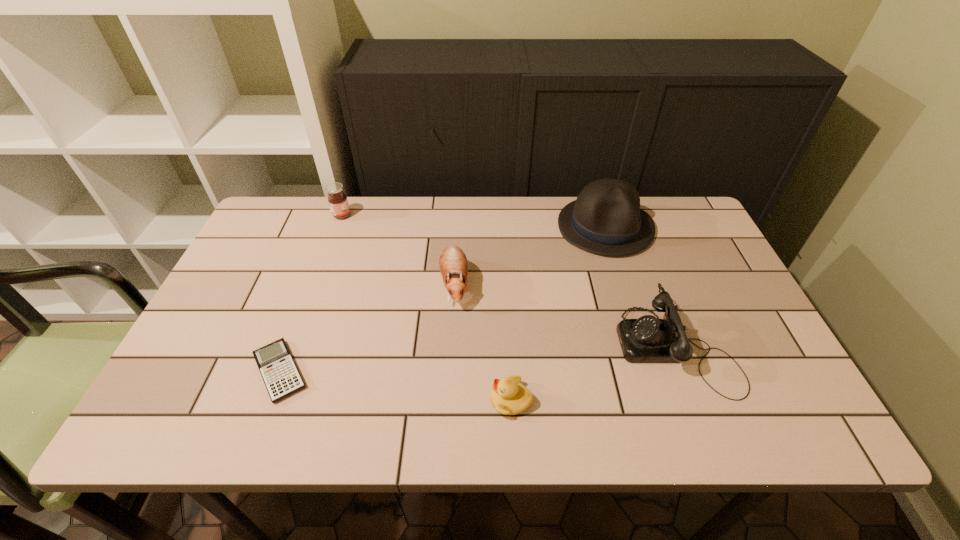
The image size is (960, 540). What are the coordinates of `blank space at the left edge of the desktop` in the screenshot? It's located at (293, 270).

At what (x,y) coordinates should I click in order to perform the action: click on vacant space at the right edge of the desktop. Please return your answer as a coordinate pair (x, y). The height and width of the screenshot is (540, 960). Looking at the image, I should click on (725, 308).

In the image, there is a desktop. At what (x,y) coordinates should I click in order to perform the action: click on vacant space at the far left corner. Please return your answer as a coordinate pair (x, y). Image resolution: width=960 pixels, height=540 pixels. Looking at the image, I should click on (262, 240).

Locate an element on the screen. vacant area at the far right corner of the desktop is located at coordinates (657, 212).

You are a GUI agent. You are given a task and a screenshot of the screen. Output one action in this format:
    pyautogui.click(x=<x>, y=<y>)
    Task: Click on the free spot between the calculator and the fourth object from right to left
    
    Given the screenshot: What is the action you would take?
    pyautogui.click(x=367, y=328)

Locate an element on the screen. The width and height of the screenshot is (960, 540). free area in between the telephone and the calculator is located at coordinates (478, 359).

Identify the location of vacant area between the fourth object from right to left and the jam. (x=398, y=250).

Locate an element on the screen. vacant point located between the second shortest object and the hamster is located at coordinates (483, 342).

This screenshot has width=960, height=540. I want to click on free spot between the jam and the tallest object, so click(x=473, y=221).

Where is `free space between the duckling and the jam`? The height and width of the screenshot is (540, 960). free space between the duckling and the jam is located at coordinates (426, 308).